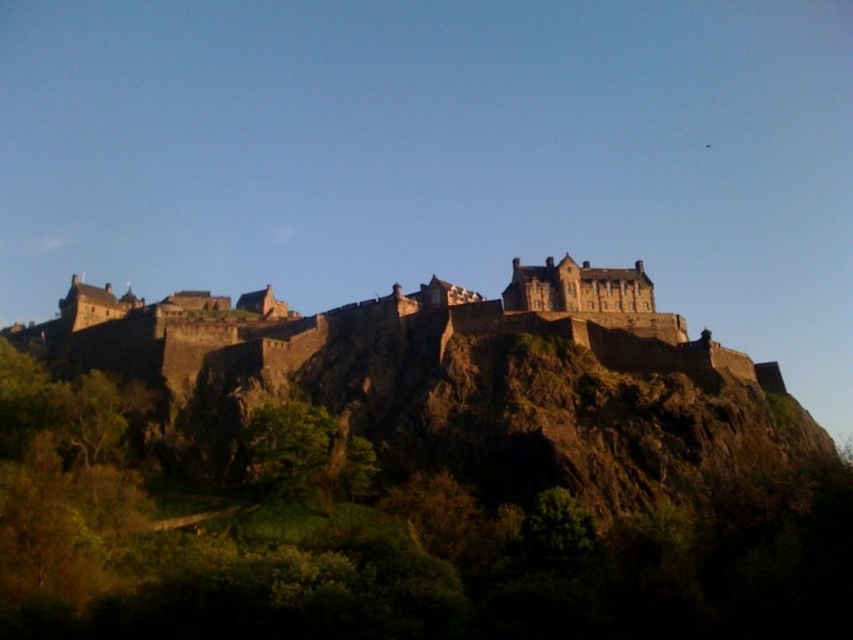
You are a tourist standing at the base of the hill looking up at Edinburgh Castle. You notice the brown rocky hillside at center and the brown stone castle at center. Which of these two objects is positioned to the right from your viewpoint?

The brown rocky hillside at center is to the right of the brown stone castle at center, so the brown rocky hillside at center is positioned to the right from your viewpoint.

Based on the photo, you are a hiker standing at the base of the hill looking up at Edinburgh Castle. You notice the brown rocky hillside at center and the brown stone castle at center. Which object is positioned higher in the image?

The brown stone castle at center is positioned higher than the brown rocky hillside at center because the brown rocky hillside at center is located below it.